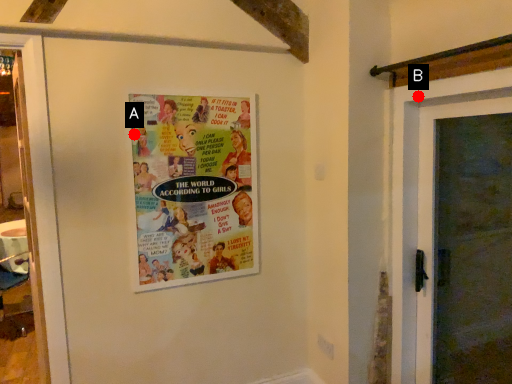
Question: Two points are circled on the image, labeled by A and B beside each circle. Which of the following is the farthest from the observer?

Choices:
 (A) A is further
 (B) B is further

Answer: (A)